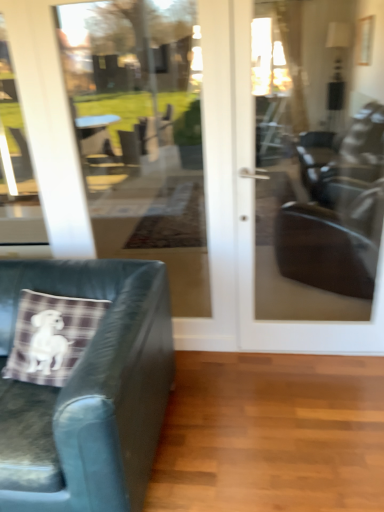
Identify the location of matte glass door at center. The height and width of the screenshot is (512, 384). (297, 321).

The image size is (384, 512). Describe the element at coordinates (102, 381) in the screenshot. I see `leather cushion at left` at that location.

The width and height of the screenshot is (384, 512). In order to click on plaid fabric pillow at lower left in this screenshot , I will do `click(51, 336)`.

Identify the location of transparent glass door at center. (140, 137).

Find the location of a particular element. The height and width of the screenshot is (512, 384). matte glass door at center is located at coordinates (297, 321).

Considering the positions of objects transparent glass door at upper left and leather cushion at left in the image provided, who is more to the right, transparent glass door at upper left or leather cushion at left?

leather cushion at left.

Can you confirm if transparent glass door at upper left is shorter than leather cushion at left?

No, transparent glass door at upper left is not shorter than leather cushion at left.

Considering the points (20, 146) and (76, 479), which point is in front, point (20, 146) or point (76, 479)?

The point (76, 479) is in front.

From a real-world perspective, is transparent glass door at upper left above or below leather cushion at left?

transparent glass door at upper left is situated higher than leather cushion at left in the real world.

Is transparent glass door at center to the right of transparent glass door at upper left from the viewer's perspective?

Correct, you'll find transparent glass door at center to the right of transparent glass door at upper left.

Between transparent glass door at center and transparent glass door at upper left, which one has less height?

With less height is transparent glass door at upper left.

Is transparent glass door at center next to transparent glass door at upper left and touching it?

No.

Does point (109, 153) come in front of point (8, 114)?

No, (109, 153) is behind (8, 114).

Is plaid fabric pillow at lower left turned away from transparent glass door at upper left?

plaid fabric pillow at lower left is not turned away from transparent glass door at upper left.

Where is `throw pillow below the transparent glass door at upper left (from the image's perspective)`? The height and width of the screenshot is (512, 384). throw pillow below the transparent glass door at upper left (from the image's perspective) is located at coordinates (51, 336).

Is the depth of plaid fabric pillow at lower left less than that of transparent glass door at upper left?

Yes, it is in front of transparent glass door at upper left.

Considering the positions of objects plaid fabric pillow at lower left and transparent glass door at center in the image provided, who is in front, plaid fabric pillow at lower left or transparent glass door at center?

plaid fabric pillow at lower left is in front.

Is plaid fabric pillow at lower left touching transparent glass door at center?

No, plaid fabric pillow at lower left is not with transparent glass door at center.

In the image, is plaid fabric pillow at lower left on the left side or the right side of transparent glass door at center?

plaid fabric pillow at lower left is to the left of transparent glass door at center.

Can you tell me how much leather cushion at left and transparent glass door at center differ in facing direction?

The angular difference between leather cushion at left and transparent glass door at center is 1.28 degrees.

Measure the distance between leather cushion at left and transparent glass door at center.

A distance of 2.52 meters exists between leather cushion at left and transparent glass door at center.

Is leather cushion at left not inside transparent glass door at center?

Yes.

Between leather cushion at left and transparent glass door at center, which one has larger size?

Bigger between the two is leather cushion at left.

From the image's perspective, which one is positioned higher, transparent glass door at upper left or transparent glass door at center?

transparent glass door at upper left is shown above in the image.

From the picture: Is transparent glass door at upper left next to transparent glass door at center?

They are not placed beside each other.

Looking at this image, what's the angular difference between transparent glass door at upper left and transparent glass door at center's facing directions?

0.0062 degrees separate the facing orientations of transparent glass door at upper left and transparent glass door at center.

Considering the sizes of objects transparent glass door at upper left and transparent glass door at center in the image provided, who is thinner, transparent glass door at upper left or transparent glass door at center?

With smaller width is transparent glass door at center.

Which object is thinner, transparent glass door at center or plaid fabric pillow at lower left?

transparent glass door at center.

Considering the relative positions of transparent glass door at center and plaid fabric pillow at lower left in the image provided, is transparent glass door at center to the right of plaid fabric pillow at lower left from the viewer's perspective?

Yes, transparent glass door at center is to the right of plaid fabric pillow at lower left.

Based on the photo, from a real-world perspective, which object rests below the other?

From a 3D spatial view, plaid fabric pillow at lower left is below.

This screenshot has height=512, width=384. In order to click on chair lying in front of the transparent glass door at upper left in this screenshot , I will do `click(102, 381)`.

Where is `window that is behind the transparent glass door at center`? The width and height of the screenshot is (384, 512). window that is behind the transparent glass door at center is located at coordinates (16, 164).

Estimate the real-world distances between objects in this image. Which object is further from transparent glass door at upper left, leather cushion at left or transparent glass door at center?

leather cushion at left lies further to transparent glass door at upper left than the other object.

From the image, which object appears to be nearer to matte glass door at center, transparent glass door at center or leather cushion at left?

Based on the image, leather cushion at left appears to be nearer to matte glass door at center.

When comparing their distances from plaid fabric pillow at lower left, does matte glass door at center or transparent glass door at center seem further?

transparent glass door at center is further to plaid fabric pillow at lower left.

When comparing their distances from leather cushion at left, does plaid fabric pillow at lower left or matte glass door at center seem closer?

plaid fabric pillow at lower left is positioned closer to the anchor leather cushion at left.

From the image, which object appears to be nearer to transparent glass door at center, transparent glass door at upper left or plaid fabric pillow at lower left?

transparent glass door at upper left lies closer to transparent glass door at center than the other object.

Considering their positions, is matte glass door at center positioned further to transparent glass door at center than plaid fabric pillow at lower left?

Based on the image, matte glass door at center appears to be further to transparent glass door at center.

From the image, which object appears to be nearer to plaid fabric pillow at lower left, leather cushion at left or matte glass door at center?

leather cushion at left is closer to plaid fabric pillow at lower left.

When comparing their distances from leather cushion at left, does transparent glass door at upper left or plaid fabric pillow at lower left seem further?

Based on the image, transparent glass door at upper left appears to be further to leather cushion at left.

Find the location of `glass door between transparent glass door at upper left and leather cushion at left in the vertical direction`. glass door between transparent glass door at upper left and leather cushion at left in the vertical direction is located at coordinates (140, 137).

Identify the location of chair situated between transparent glass door at upper left and matte glass door at center from left to right. Image resolution: width=384 pixels, height=512 pixels. (102, 381).

In order to click on glass door between plaid fabric pillow at lower left and matte glass door at center in the horizontal direction in this screenshot , I will do `click(140, 137)`.

You are a GUI agent. You are given a task and a screenshot of the screen. Output one action in this format:
    pyautogui.click(x=<x>, y=<y>)
    Task: Click on the throw pillow between transparent glass door at upper left and leather cushion at left vertically
    The image size is (384, 512).
    Given the screenshot: What is the action you would take?
    pyautogui.click(x=51, y=336)